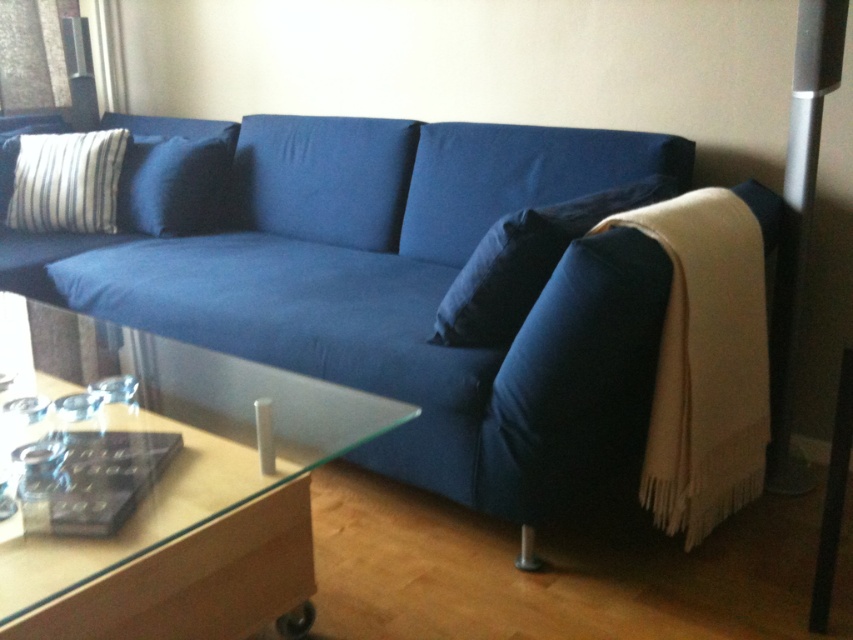
You are arranging a living room and want to place a tall vase between the dark blue fabric pillow at center and the blue fabric pillow at upper left. Which pillow should the vase be placed closer to in order to avoid blocking the view of the taller pillow?

The vase should be placed closer to the dark blue fabric pillow at center because the blue fabric pillow at upper left is taller, so placing the vase closer to the shorter pillow will prevent blocking the view of the taller one.

You are a guest entering the living room and want to sit on the beige woolen blanket at lower right. Which direction should you move relative to the matte blue couch at center?

The beige woolen blanket at lower right is to the right of the matte blue couch at center, so you should move to the right side of the matte blue couch at center to reach the beige woolen blanket at lower right.